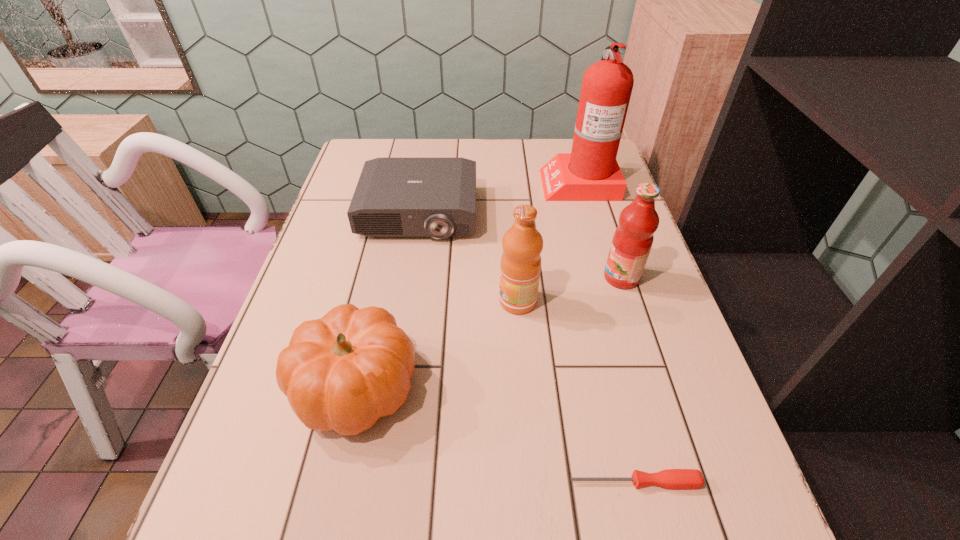
This screenshot has height=540, width=960. I want to click on free space located at the tip of the nearest object, so click(x=422, y=482).

This screenshot has height=540, width=960. Identify the location of vacant region located 0.280m at the tip of the nearest object. (397, 482).

The image size is (960, 540). Find the location of `object at the far edge`. object at the far edge is located at coordinates (590, 172).

This screenshot has height=540, width=960. Identify the location of pumpkin at the left edge. (342, 372).

Image resolution: width=960 pixels, height=540 pixels. I want to click on projector at the left edge, so click(395, 197).

Where is `fire extinguisher situated at the right edge`? This screenshot has width=960, height=540. fire extinguisher situated at the right edge is located at coordinates (590, 172).

Image resolution: width=960 pixels, height=540 pixels. In order to click on fruit juice present at the right edge in this screenshot , I will do click(x=632, y=241).

Image resolution: width=960 pixels, height=540 pixels. Find the location of `screwdriver positioned at the right edge`. screwdriver positioned at the right edge is located at coordinates (669, 478).

Locate an element on the screen. This screenshot has width=960, height=540. object present at the far right corner is located at coordinates (590, 172).

Find the location of a particular element. free location at the far edge of the desktop is located at coordinates (531, 151).